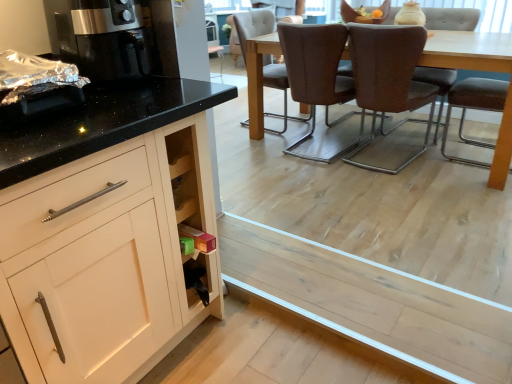
Image resolution: width=512 pixels, height=384 pixels. I want to click on brown leather chair at upper right, the 2th chair from the right, so click(451, 18).

What do you see at coordinates (451, 18) in the screenshot? This screenshot has height=384, width=512. I see `brown leather chair at upper right, the 2th chair from the right` at bounding box center [451, 18].

Describe the element at coordinates (388, 77) in the screenshot. I see `brown leather chair at center, placed as the 3th chair when sorted from right to left` at that location.

What do you see at coordinates (372, 302) in the screenshot? I see `light wood plank at lower center` at bounding box center [372, 302].

Identify the location of brown leather chair at upper right, the 2th chair from the right. (451, 18).

Does brown leather chair at center, the 4th chair in the right-to-left sequence, turn towards brown fabric chair at center, the 5th chair positioned from the right?

No, brown leather chair at center, the 4th chair in the right-to-left sequence, is not aimed at brown fabric chair at center, the 5th chair positioned from the right.

Considering their positions, is brown leather chair at center, the 2th chair when ordered from left to right, located in front of or behind brown fabric chair at center, the 5th chair positioned from the right?

Visually, brown leather chair at center, the 2th chair when ordered from left to right, is located in front of brown fabric chair at center, the 5th chair positioned from the right.

Could you measure the distance between brown leather chair at center, the 4th chair in the right-to-left sequence, and brown fabric chair at center, the 1th chair positioned from the left?

The distance of brown leather chair at center, the 4th chair in the right-to-left sequence, from brown fabric chair at center, the 1th chair positioned from the left, is 40.21 centimeters.

Does brown leather chair at center, the 2th chair when ordered from left to right, have a smaller size compared to brown fabric chair at center, the 5th chair positioned from the right?

Correct, brown leather chair at center, the 2th chair when ordered from left to right, occupies less space than brown fabric chair at center, the 5th chair positioned from the right.

Can you tell me how much brown fabric chair at center, the 5th chair positioned from the right, and brown leather chair at center, the 2th chair when ordered from left to right, differ in facing direction?

The angular difference between brown fabric chair at center, the 5th chair positioned from the right, and brown leather chair at center, the 2th chair when ordered from left to right, is 94 degrees.

Is brown fabric chair at center, the 5th chair positioned from the right, oriented away from brown leather chair at center, the 4th chair in the right-to-left sequence?

brown fabric chair at center, the 5th chair positioned from the right, does not have its back to brown leather chair at center, the 4th chair in the right-to-left sequence.

Is brown fabric chair at center, the 5th chair positioned from the right, outside of brown leather chair at center, the 2th chair when ordered from left to right?

Yes, brown fabric chair at center, the 5th chair positioned from the right, is located beyond the bounds of brown leather chair at center, the 2th chair when ordered from left to right.

Visually, is brown fabric chair at center, the 1th chair positioned from the left, positioned to the left or to the right of brown leather chair at center, the 4th chair in the right-to-left sequence?

From the image, it's evident that brown fabric chair at center, the 1th chair positioned from the left, is to the left of brown leather chair at center, the 4th chair in the right-to-left sequence.

Are satin black coffee machine at left and brown leather chair at center, the 1th chair when ordered from right to left, beside each other?

satin black coffee machine at left and brown leather chair at center, the 1th chair when ordered from right to left, are not in contact.

Which object is thinner, satin black coffee machine at left or brown leather chair at center, the fifth chair when ordered from left to right?

Thinner between the two is satin black coffee machine at left.

Between satin black coffee machine at left and brown leather chair at center, the 1th chair when ordered from right to left, which one appears on the left side from the viewer's perspective?

satin black coffee machine at left is more to the left.

Is light wood plank at lower center smaller than brown fabric chair at center, the 1th chair positioned from the left?

Yes.

This screenshot has width=512, height=384. Find the location of `plank that appears on the right of brown fabric chair at center, the 1th chair positioned from the left`. plank that appears on the right of brown fabric chair at center, the 1th chair positioned from the left is located at coordinates (372, 302).

Is light wood plank at lower center next to brown fabric chair at center, the 5th chair positioned from the right, and touching it?

No, light wood plank at lower center is not making contact with brown fabric chair at center, the 5th chair positioned from the right.

From a real-world perspective, does light wood plank at lower center sit lower than brown fabric chair at center, the 5th chair positioned from the right?

Yes.

Could you measure the distance between brown leather chair at upper right, the fourth chair when ordered from left to right, and brown fabric chair at center, the 1th chair positioned from the left?

The distance of brown leather chair at upper right, the fourth chair when ordered from left to right, from brown fabric chair at center, the 1th chair positioned from the left, is 1.25 meters.

Is brown leather chair at upper right, the 2th chair from the right, shorter than brown fabric chair at center, the 1th chair positioned from the left?

Indeed, brown leather chair at upper right, the 2th chair from the right, has a lesser height compared to brown fabric chair at center, the 1th chair positioned from the left.

From the image's perspective, is brown leather chair at upper right, the 2th chair from the right, located above brown fabric chair at center, the 1th chair positioned from the left?

No.

In order to click on chair that is the 1st object located in front of the brown fabric chair at center, the 1th chair positioned from the left in this screenshot , I will do `click(451, 18)`.

The image size is (512, 384). What are the coordinates of `the 1st chair directly beneath the brown leather chair at upper right, the 2th chair from the right (from a real-world perspective)` in the screenshot? It's located at (388, 77).

How many degrees apart are the facing directions of brown leather chair at center, placed as the 3th chair when sorted from right to left, and brown leather chair at upper right, the 2th chair from the right?

The facing directions of brown leather chair at center, placed as the 3th chair when sorted from right to left, and brown leather chair at upper right, the 2th chair from the right, are 177 degrees apart.

Is brown leather chair at center, placed as the 3th chair when sorted from right to left, positioned with its back to brown leather chair at upper right, the 2th chair from the right?

No, brown leather chair at upper right, the 2th chair from the right, is not at the back of brown leather chair at center, placed as the 3th chair when sorted from right to left.

Which object is further away from the camera taking this photo, brown leather chair at center, placed as the 3th chair when sorted from right to left, or brown leather chair at upper right, the fourth chair when ordered from left to right?

brown leather chair at upper right, the fourth chair when ordered from left to right, is behind.

Between brown leather chair at upper right, the 2th chair from the right, and brown leather chair at center, the fifth chair when ordered from left to right, which one has smaller size?

With smaller size is brown leather chair at center, the fifth chair when ordered from left to right.

Is brown leather chair at upper right, the 2th chair from the right, taller or shorter than brown leather chair at center, the 1th chair when ordered from right to left?

Clearly, brown leather chair at upper right, the 2th chair from the right, is taller compared to brown leather chair at center, the 1th chair when ordered from right to left.

Is brown leather chair at upper right, the fourth chair when ordered from left to right, in contact with brown leather chair at center, the 1th chair when ordered from right to left?

brown leather chair at upper right, the fourth chair when ordered from left to right, and brown leather chair at center, the 1th chair when ordered from right to left, are clearly separated.

Considering the sizes of objects brown leather chair at upper right, the fourth chair when ordered from left to right, and brown leather chair at center, the 1th chair when ordered from right to left, in the image provided, who is thinner, brown leather chair at upper right, the fourth chair when ordered from left to right, or brown leather chair at center, the 1th chair when ordered from right to left,?

brown leather chair at center, the 1th chair when ordered from right to left.

Identify the location of the 2nd chair below the brown fabric chair at center, the 1th chair positioned from the left (from the image's perspective). The image size is (512, 384). (316, 73).

Which chair is the 2nd one when counting from the back of the brown leather chair at center, the 2th chair when ordered from left to right? Please provide its 2D coordinates.

[(253, 25)]

From the image, which object appears to be nearer to satin black coffee machine at left, brown leather chair at center, the fifth chair when ordered from left to right, or brown leather chair at center, placed as the 3th chair when sorted from right to left?

brown leather chair at center, placed as the 3th chair when sorted from right to left, lies closer to satin black coffee machine at left than the other object.

Looking at the image, which one is located closer to brown fabric chair at center, the 5th chair positioned from the right, brown leather chair at center, the fifth chair when ordered from left to right, or brown leather chair at center, the third chair positioned from the left?

Based on the image, brown leather chair at center, the third chair positioned from the left, appears to be nearer to brown fabric chair at center, the 5th chair positioned from the right.

From the image, which object appears to be farther from satin black coffee machine at left, brown leather chair at center, the 1th chair when ordered from right to left, or light wood plank at lower center?

Among the two, brown leather chair at center, the 1th chair when ordered from right to left, is located further to satin black coffee machine at left.

Looking at the image, which one is located further to satin black coffee machine at left, brown leather chair at upper right, the 2th chair from the right, or brown leather chair at center, the 1th chair when ordered from right to left?

brown leather chair at upper right, the 2th chair from the right, is positioned further to the anchor satin black coffee machine at left.

Estimate the real-world distances between objects in this image. Which object is further from brown leather chair at center, the 4th chair in the right-to-left sequence, brown leather chair at upper right, the fourth chair when ordered from left to right, or light wood plank at lower center?

The object further to brown leather chair at center, the 4th chair in the right-to-left sequence, is light wood plank at lower center.

Which object lies nearer to the anchor point brown leather chair at center, the 2th chair when ordered from left to right, light wood plank at lower center or brown leather chair at center, placed as the 3th chair when sorted from right to left?

Among the two, brown leather chair at center, placed as the 3th chair when sorted from right to left, is located nearer to brown leather chair at center, the 2th chair when ordered from left to right.

When comparing their distances from satin black coffee machine at left, does brown leather chair at center, placed as the 3th chair when sorted from right to left, or brown leather chair at center, the fifth chair when ordered from left to right, seem further?

brown leather chair at center, the fifth chair when ordered from left to right, lies further to satin black coffee machine at left than the other object.

Based on their spatial positions, is brown fabric chair at center, the 5th chair positioned from the right, or satin black coffee machine at left closer to brown leather chair at center, the fifth chair when ordered from left to right?

brown fabric chair at center, the 5th chair positioned from the right.

Where is `plank between satin black coffee machine at left and brown leather chair at center, the fifth chair when ordered from left to right, from left to right`? plank between satin black coffee machine at left and brown leather chair at center, the fifth chair when ordered from left to right, from left to right is located at coordinates (372, 302).

Where is `plank situated between satin black coffee machine at left and brown leather chair at center, the third chair positioned from the left, from left to right`? plank situated between satin black coffee machine at left and brown leather chair at center, the third chair positioned from the left, from left to right is located at coordinates (372, 302).

Locate an element on the screen. plank located between satin black coffee machine at left and brown leather chair at center, the 4th chair in the right-to-left sequence, in the depth direction is located at coordinates (372, 302).

Where is `plank situated between satin black coffee machine at left and brown leather chair at upper right, the fourth chair when ordered from left to right, from left to right`? This screenshot has width=512, height=384. plank situated between satin black coffee machine at left and brown leather chair at upper right, the fourth chair when ordered from left to right, from left to right is located at coordinates (372, 302).